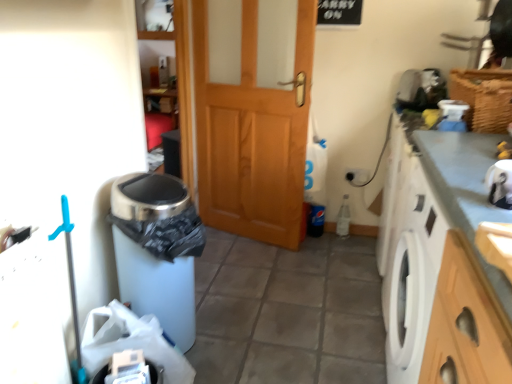
The width and height of the screenshot is (512, 384). Find the location of `free location in front of wooden door at center`. free location in front of wooden door at center is located at coordinates [x=262, y=278].